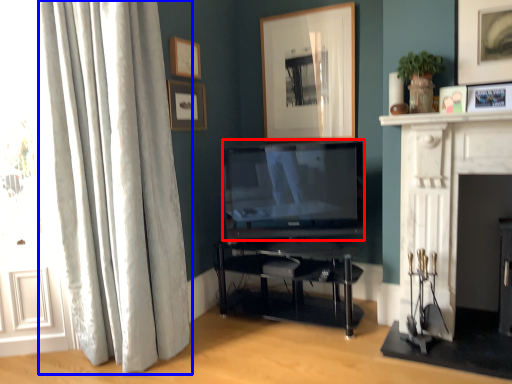
Question: Which object is further to the camera taking this photo, television (highlighted by a red box) or curtain (highlighted by a blue box)?

Choices:
 (A) television
 (B) curtain

Answer: (A)